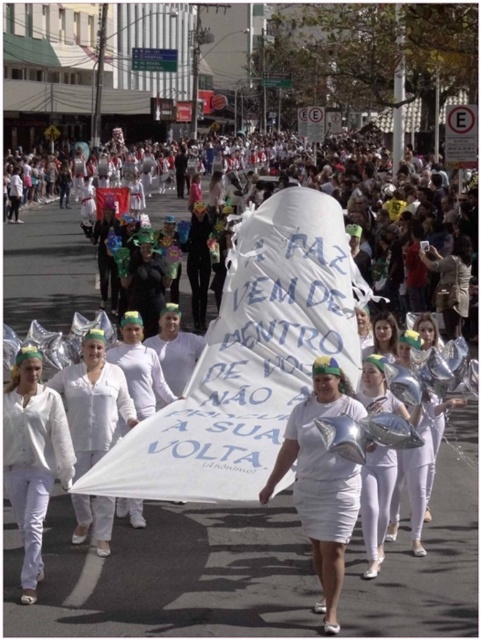
Between white glossy balloon at center and matte white dress at center, which one appears on the left side from the viewer's perspective?

white glossy balloon at center

Who is higher up, white glossy balloon at center or matte white dress at center?

matte white dress at center is higher up.

Is point (370, 573) positioned in front of point (391, 320)?

Yes, it is.

Locate an element on the screen. white glossy balloon at center is located at coordinates [x=377, y=502].

From the picture: Who is higher up, white matte dress at center or white matte shirt at center?

white matte shirt at center is higher up.

Who is taller, white matte dress at center or white matte shirt at center?

white matte shirt at center

What do you see at coordinates (321, 481) in the screenshot? I see `white matte dress at center` at bounding box center [321, 481].

Identify the location of white matte dress at center. Image resolution: width=481 pixels, height=640 pixels. (321, 481).

Which is in front, point (35, 474) or point (371, 513)?

Point (35, 474) is more forward.

Does white matte uniform at center have a lesser height compared to white glossy balloon at center?

No, white matte uniform at center is not shorter than white glossy balloon at center.

Who is more forward, (54, 438) or (380, 472)?

Positioned in front is point (54, 438).

The width and height of the screenshot is (481, 640). I want to click on white matte uniform at center, so click(x=33, y=458).